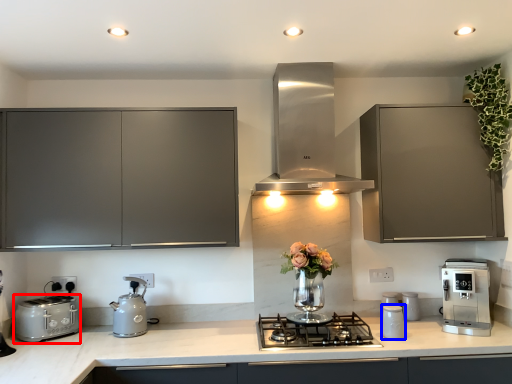
Question: Which object is closer to the camera taking this photo, toaster (highlighted by a red box) or kitchen appliance (highlighted by a blue box)?

Choices:
 (A) toaster
 (B) kitchen appliance

Answer: (A)